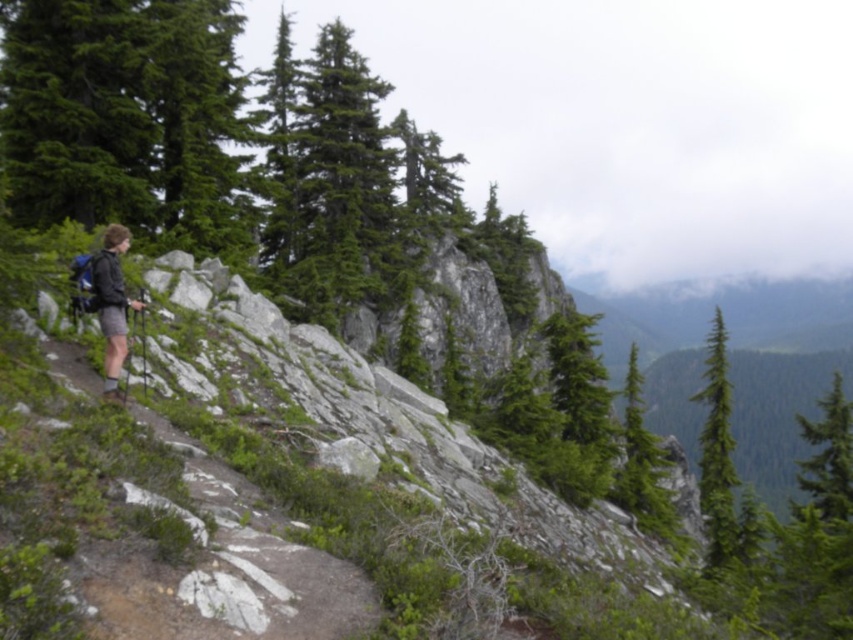
You are a hiker navigating a rugged trail and you see the green matte tree at right. Based on its position, can you determine if it is closer to you or further away compared to the trail?

The green matte tree at right is located at point (717,452), which places it further away from the hiker compared to the trail they are on.

You are a hiker planning to take a photo of the green matte tree at right and the matte black backpack at left. Which object should you focus on first if you want to capture both in a single frame without moving the camera?

You should focus on the green matte tree at right first because it is wider than the matte black backpack at left, ensuring it fits properly in the frame.